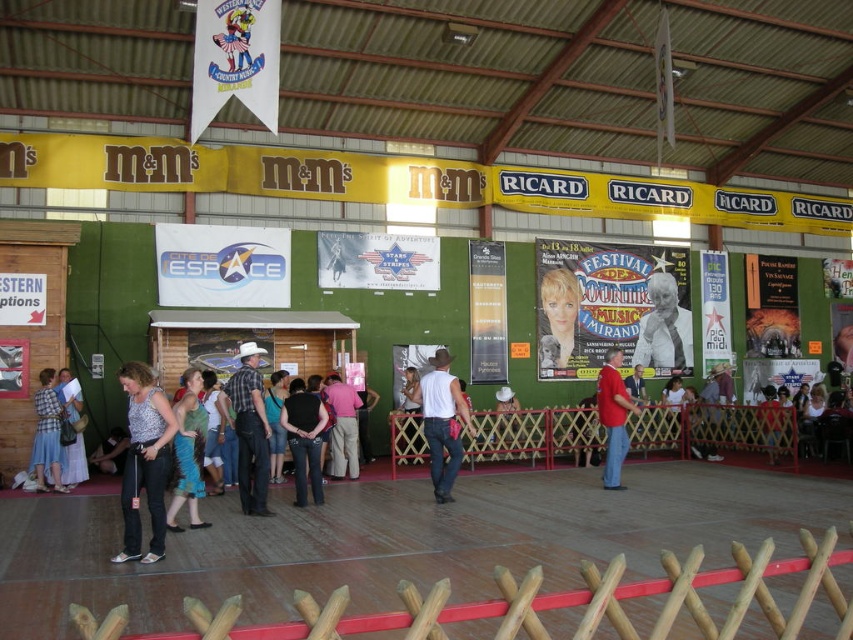
Does denim pants at center have a greater height compared to white fabric hat at center?

Yes, denim pants at center is taller than white fabric hat at center.

Does denim pants at center have a lesser height compared to white fabric hat at center?

Incorrect, denim pants at center's height does not fall short of white fabric hat at center's.

Identify the location of denim pants at center. (144, 461).

Is white paper poster at center further to camera compared to matte white dress at lower left?

Yes, white paper poster at center is behind matte white dress at lower left.

Does white paper poster at center appear under matte white dress at lower left?

No, white paper poster at center is not below matte white dress at lower left.

Between point (654, 348) and point (73, 465), which one is positioned in front?

Point (73, 465)

Find the location of a particular element. This screenshot has height=640, width=853. white paper poster at center is located at coordinates (664, 330).

The image size is (853, 640). What are the coordinates of `matte red shirt at center` in the screenshot? It's located at click(x=613, y=417).

Can you confirm if matte red shirt at center is thinner than pink cotton shirt at center?

Indeed, matte red shirt at center has a lesser width compared to pink cotton shirt at center.

This screenshot has width=853, height=640. Find the location of `matte red shirt at center`. matte red shirt at center is located at coordinates (613, 417).